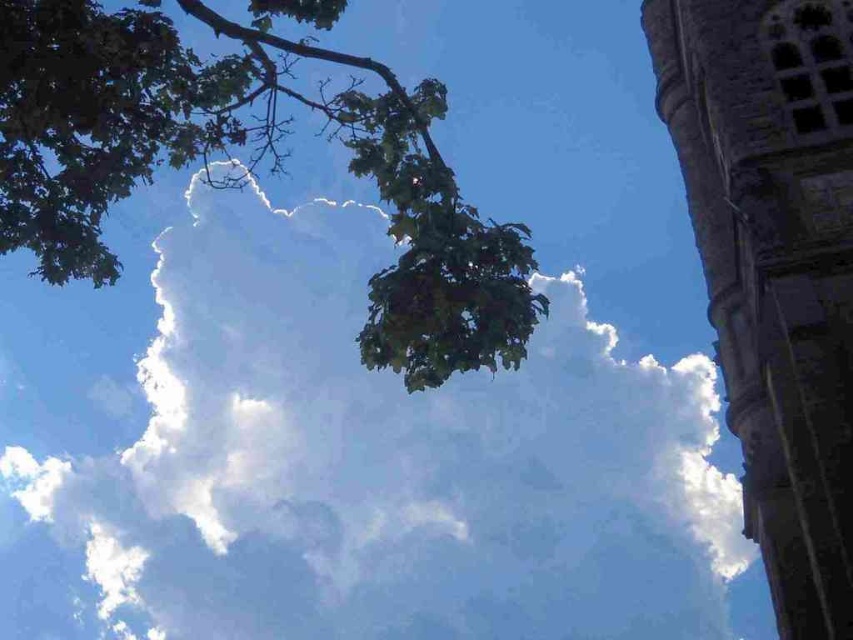
Who is taller, white fluffy cloud at upper center or stone tower at upper right?

With more height is white fluffy cloud at upper center.

Between white fluffy cloud at upper center and stone tower at upper right, which one appears on the right side from the viewer's perspective?

From the viewer's perspective, stone tower at upper right appears more on the right side.

Who is more distant from viewer, (404,444) or (672,45)?

The point (404,444) is more distant.

This screenshot has width=853, height=640. I want to click on white fluffy cloud at upper center, so click(387, 461).

Can you confirm if white fluffy cloud at upper center is positioned to the right of green leafy tree at upper left?

Correct, you'll find white fluffy cloud at upper center to the right of green leafy tree at upper left.

How much distance is there between white fluffy cloud at upper center and green leafy tree at upper left?

white fluffy cloud at upper center is 46.32 feet from green leafy tree at upper left.

Between point (344, 388) and point (518, 353), which one is positioned in front?

Point (518, 353) is in front.

Identify the location of white fluffy cloud at upper center. This screenshot has height=640, width=853. (387, 461).

Can you confirm if green leafy tree at upper left is positioned below stone tower at upper right?

Incorrect, green leafy tree at upper left is not positioned below stone tower at upper right.

You are a GUI agent. You are given a task and a screenshot of the screen. Output one action in this format:
    pyautogui.click(x=<x>, y=<y>)
    Task: Click on the green leafy tree at upper left
    
    Given the screenshot: What is the action you would take?
    pos(250,163)